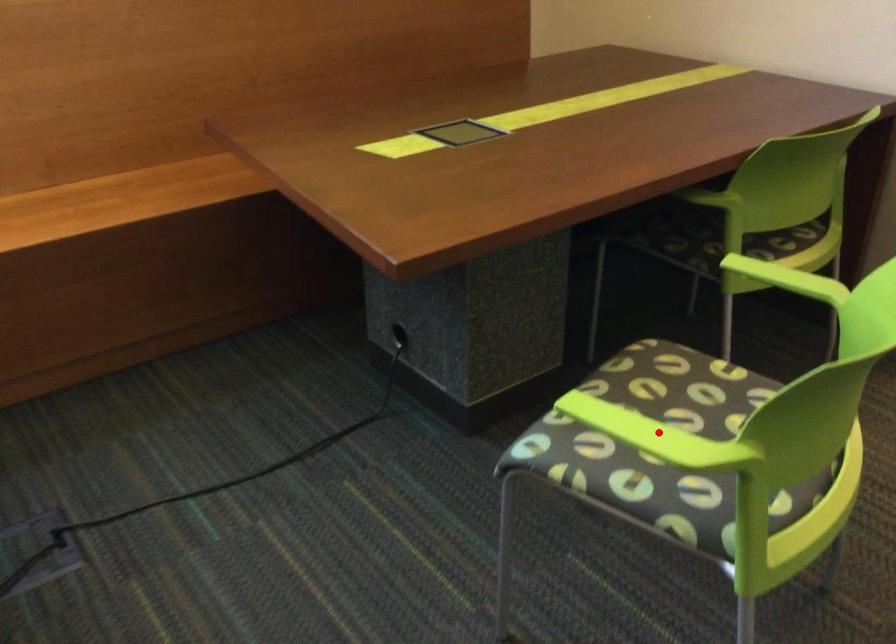
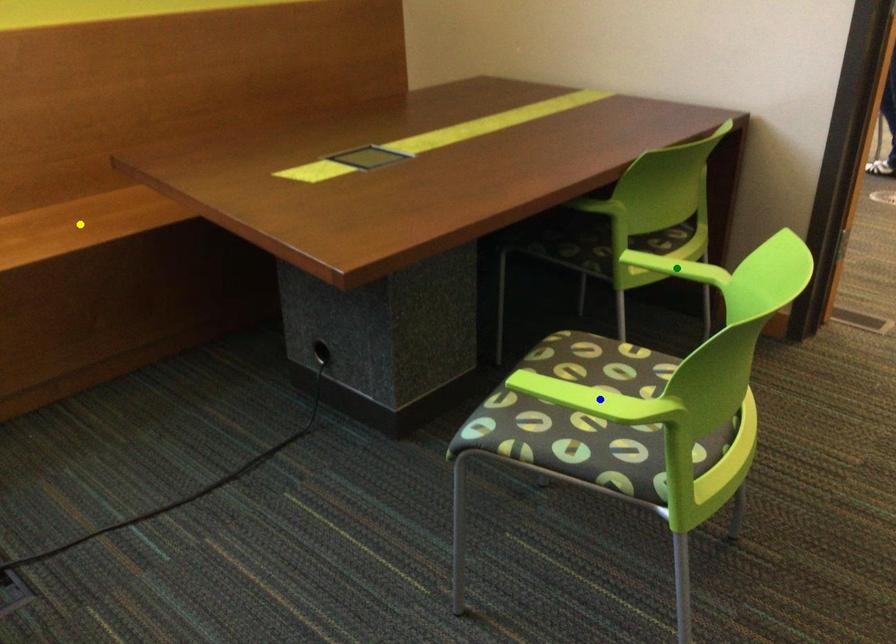
Question: I am providing you with two images of the same scene from different viewpoints. A red point is marked on the first image. You are given multiple points on the second image. Which spot in image 2 lines up with the point in image 1?

Choices:
 (A) yellow point
 (B) blue point
 (C) green point

Answer: (B)